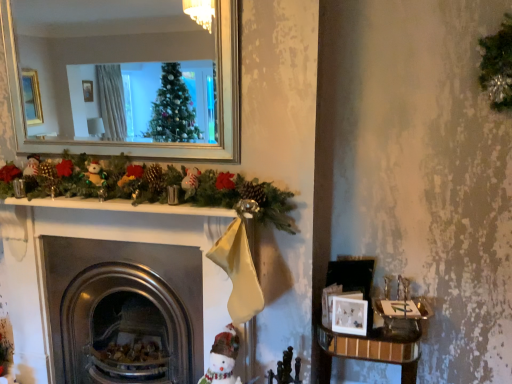
Question: Could you tell me if metallic fireplace at center is facing white fabric snowman at lower center?

Choices:
 (A) no
 (B) yes

Answer: (A)

Question: Considering the relative positions of metallic fireplace at center and white fabric snowman at lower center in the image provided, is metallic fireplace at center to the left of white fabric snowman at lower center from the viewer's perspective?

Choices:
 (A) yes
 (B) no

Answer: (A)

Question: Would you say white fabric snowman at lower center is part of metallic fireplace at center's contents?

Choices:
 (A) no
 (B) yes

Answer: (A)

Question: Is metallic fireplace at center wider than white fabric snowman at lower center?

Choices:
 (A) no
 (B) yes

Answer: (B)

Question: Is metallic fireplace at center turned away from white fabric snowman at lower center?

Choices:
 (A) no
 (B) yes

Answer: (A)

Question: From the image's perspective, is white matte picture frame at lower right located above or below metallic fireplace at center?

Choices:
 (A) above
 (B) below

Answer: (A)

Question: In terms of size, does white matte picture frame at lower right appear bigger or smaller than metallic fireplace at center?

Choices:
 (A) big
 (B) small

Answer: (B)

Question: Considering the positions of white matte picture frame at lower right and metallic fireplace at center in the image, is white matte picture frame at lower right wider or thinner than metallic fireplace at center?

Choices:
 (A) thin
 (B) wide

Answer: (A)

Question: Relative to metallic fireplace at center, is white matte picture frame at lower right in front or behind?

Choices:
 (A) behind
 (B) front

Answer: (A)

Question: From the image's perspective, is wooden table at lower right located above or below metallic fireplace at center?

Choices:
 (A) below
 (B) above

Answer: (A)

Question: Is wooden table at lower right spatially inside metallic fireplace at center, or outside of it?

Choices:
 (A) inside
 (B) outside

Answer: (B)

Question: In the image, is wooden table at lower right positioned in front of or behind metallic fireplace at center?

Choices:
 (A) behind
 (B) front

Answer: (B)

Question: From a real-world perspective, is wooden table at lower right positioned above or below metallic fireplace at center?

Choices:
 (A) below
 (B) above

Answer: (A)

Question: Does point (397, 332) appear closer or farther from the camera than point (332, 312)?

Choices:
 (A) closer
 (B) farther

Answer: (A)

Question: In the image, is wooden table at lower right on the left side or the right side of white matte picture frame at lower right?

Choices:
 (A) right
 (B) left

Answer: (A)